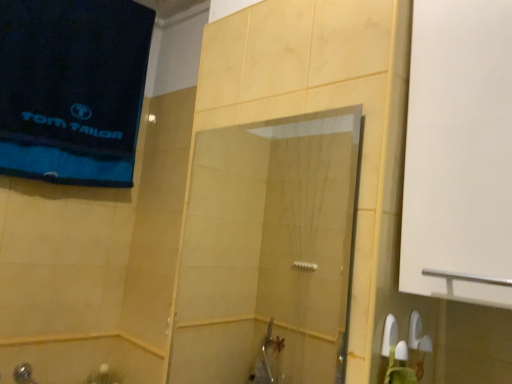
Describe the element at coordinates (72, 89) in the screenshot. I see `blue cotton towel at upper left` at that location.

Where is `blue cotton towel at upper left`? This screenshot has height=384, width=512. blue cotton towel at upper left is located at coordinates (72, 89).

Looking at this image, measure the distance between point (25, 375) and camera.

Point (25, 375) and camera are 5.02 feet apart.

The height and width of the screenshot is (384, 512). What do you see at coordinates (23, 374) in the screenshot?
I see `shiny metallic showerhead at lower left` at bounding box center [23, 374].

Locate an element on the screen. blue cotton towel at upper left is located at coordinates (72, 89).

Which of these two, shiny metallic showerhead at lower left or blue cotton towel at upper left, is bigger?

blue cotton towel at upper left.

How many degrees apart are the facing directions of shiny metallic showerhead at lower left and blue cotton towel at upper left?

There is a 2.68-degree angle between the facing directions of shiny metallic showerhead at lower left and blue cotton towel at upper left.

Is shiny metallic showerhead at lower left next to blue cotton towel at upper left and touching it?

No.

Is the depth of shiny metallic showerhead at lower left less than that of blue cotton towel at upper left?

That is False.

Where is `screen door lying above the shiny metallic showerhead at lower left (from the image's perspective)`? The height and width of the screenshot is (384, 512). screen door lying above the shiny metallic showerhead at lower left (from the image's perspective) is located at coordinates (268, 252).

From the image's perspective, is shiny metallic showerhead at lower left located beneath transparent glass shower door at center?

Correct, shiny metallic showerhead at lower left appears lower than transparent glass shower door at center in the image.

From a real-world perspective, who is located higher, shiny metallic showerhead at lower left or transparent glass shower door at center?

transparent glass shower door at center.

Is blue cotton towel at upper left inside the boundaries of shiny metallic showerhead at lower left, or outside?

The correct answer is: outside.

From the image's perspective, is blue cotton towel at upper left below shiny metallic showerhead at lower left?

No, from the image's perspective, blue cotton towel at upper left is not below shiny metallic showerhead at lower left.

Can you confirm if blue cotton towel at upper left is positioned to the right of shiny metallic showerhead at lower left?

Yes, blue cotton towel at upper left is to the right of shiny metallic showerhead at lower left.

Considering the sizes of objects blue cotton towel at upper left and shiny metallic showerhead at lower left in the image provided, who is taller, blue cotton towel at upper left or shiny metallic showerhead at lower left?

With more height is blue cotton towel at upper left.

Is point (249, 371) closer to camera compared to point (26, 366)?

No, it is behind (26, 366).

Can you confirm if transparent glass shower door at center is taller than shiny metallic showerhead at lower left?

Yes.

Are transparent glass shower door at center and shiny metallic showerhead at lower left located far from each other?

Indeed, transparent glass shower door at center is not near shiny metallic showerhead at lower left.

From the image's perspective, who appears lower, transparent glass shower door at center or shiny metallic showerhead at lower left?

shiny metallic showerhead at lower left.

In the image, is transparent glass shower door at center on the left side or the right side of blue cotton towel at upper left?

transparent glass shower door at center is to the right of blue cotton towel at upper left.

Is transparent glass shower door at center looking in the opposite direction of blue cotton towel at upper left?

No, transparent glass shower door at center is not facing the opposite direction of blue cotton towel at upper left.

The image size is (512, 384). In order to click on screen door located below the blue cotton towel at upper left (from the image's perspective) in this screenshot , I will do `click(268, 252)`.

Considering the relative sizes of transparent glass shower door at center and blue cotton towel at upper left in the image provided, is transparent glass shower door at center shorter than blue cotton towel at upper left?

Correct, transparent glass shower door at center is not as tall as blue cotton towel at upper left.

Can you confirm if blue cotton towel at upper left is wider than transparent glass shower door at center?

Indeed, blue cotton towel at upper left has a greater width compared to transparent glass shower door at center.

Can transparent glass shower door at center be found inside blue cotton towel at upper left?

No, transparent glass shower door at center is not a part of blue cotton towel at upper left.

From the image's perspective, between blue cotton towel at upper left and transparent glass shower door at center, which one is located above?

blue cotton towel at upper left appears higher in the image.

Relative to transparent glass shower door at center, is blue cotton towel at upper left in front or behind?

blue cotton towel at upper left is positioned farther from the viewer than transparent glass shower door at center.

Locate an element on the screen. This screenshot has width=512, height=384. beach towel to the right of shiny metallic showerhead at lower left is located at coordinates (72, 89).

The image size is (512, 384). Identify the location of screen door that is above the shiny metallic showerhead at lower left (from the image's perspective). (268, 252).

When comparing their distances from shiny metallic showerhead at lower left, does transparent glass shower door at center or blue cotton towel at upper left seem further?

The object further to shiny metallic showerhead at lower left is transparent glass shower door at center.

Based on their spatial positions, is shiny metallic showerhead at lower left or transparent glass shower door at center closer to blue cotton towel at upper left?

The object closer to blue cotton towel at upper left is transparent glass shower door at center.

When comparing their distances from transparent glass shower door at center, does blue cotton towel at upper left or shiny metallic showerhead at lower left seem closer?

The object closer to transparent glass shower door at center is blue cotton towel at upper left.

Which object lies nearer to the anchor point shiny metallic showerhead at lower left, blue cotton towel at upper left or transparent glass shower door at center?

blue cotton towel at upper left lies closer to shiny metallic showerhead at lower left than the other object.

From the image, which object appears to be farther from blue cotton towel at upper left, transparent glass shower door at center or shiny metallic showerhead at lower left?

shiny metallic showerhead at lower left is further to blue cotton towel at upper left.

Estimate the real-world distances between objects in this image. Which object is further from transparent glass shower door at center, shiny metallic showerhead at lower left or blue cotton towel at upper left?

Among the two, shiny metallic showerhead at lower left is located further to transparent glass shower door at center.

Where is `screen door that lies between blue cotton towel at upper left and shiny metallic showerhead at lower left from top to bottom`? The image size is (512, 384). screen door that lies between blue cotton towel at upper left and shiny metallic showerhead at lower left from top to bottom is located at coordinates (268, 252).